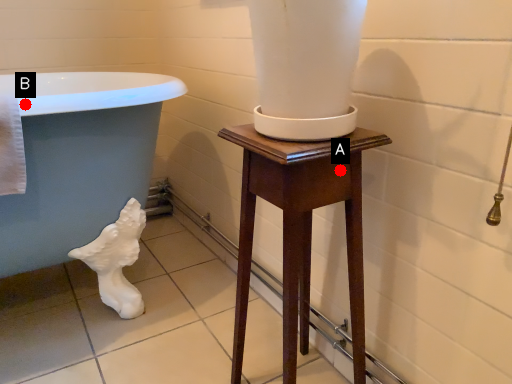
Question: Two points are circled on the image, labeled by A and B beside each circle. Which point is closer to the camera?

Choices:
 (A) A is closer
 (B) B is closer

Answer: (A)